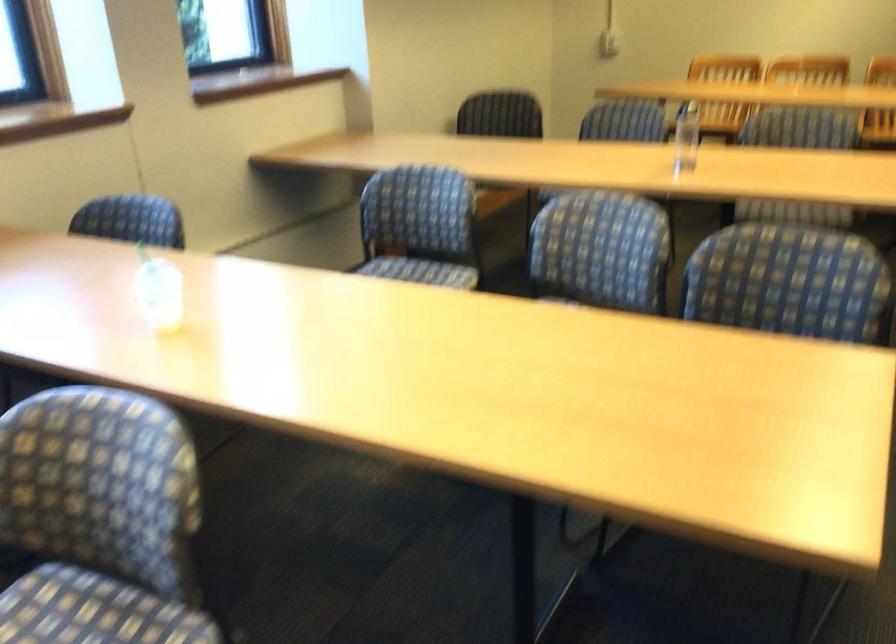
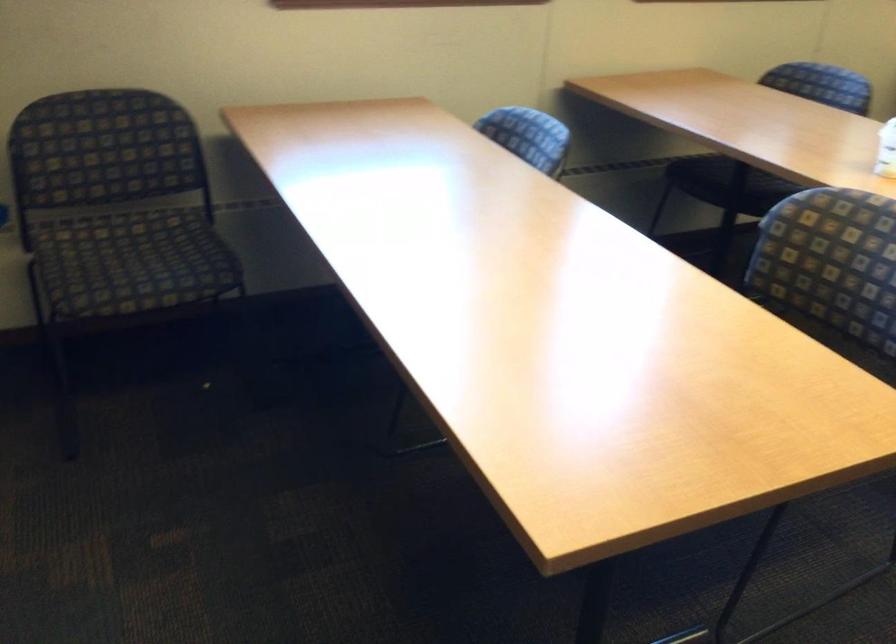
Locate, in the second image, the point that corresponds to (x=147, y=310) in the first image.

(885, 149)